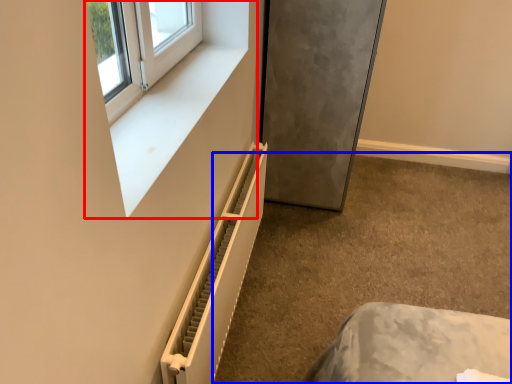
Question: Among these objects, which one is farthest to the camera, window frame (highlighted by a red box) or concrete (highlighted by a blue box)?

Choices:
 (A) window frame
 (B) concrete

Answer: (B)